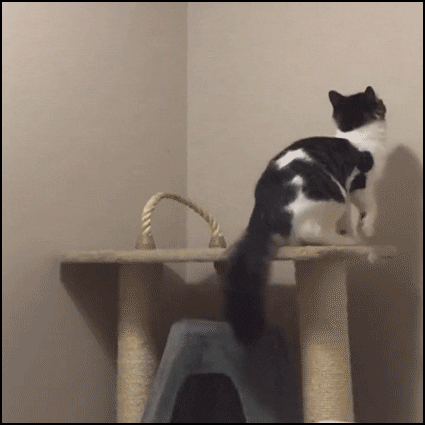
Find the location of a particular element. This screenshot has width=425, height=425. white wall is located at coordinates (263, 298).